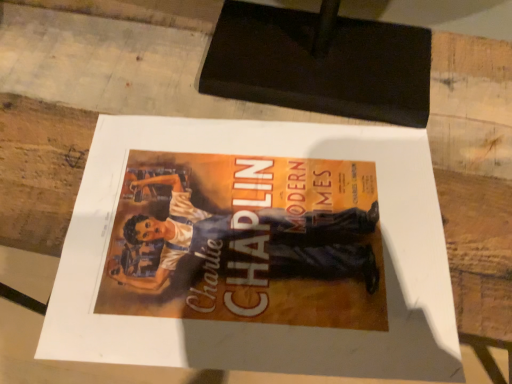
Identify the location of free space above matte paper poster at center (from a real-world perspective). (229, 133).